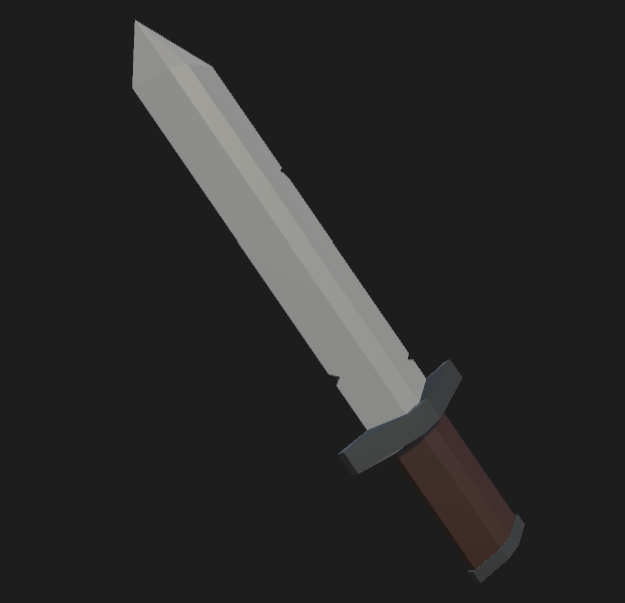
The height and width of the screenshot is (603, 625). In order to click on empty space at top right corner in this screenshot , I will do `click(620, 7)`.